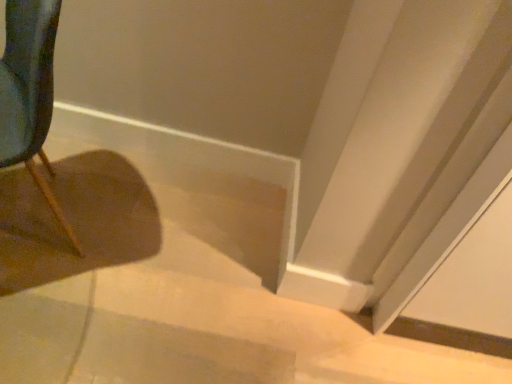
Find the location of a particular element. The height and width of the screenshot is (384, 512). matte brown chair at left is located at coordinates (30, 92).

This screenshot has height=384, width=512. What do you see at coordinates (30, 92) in the screenshot?
I see `matte brown chair at left` at bounding box center [30, 92].

Identify the location of matte brown chair at left. This screenshot has height=384, width=512. (30, 92).